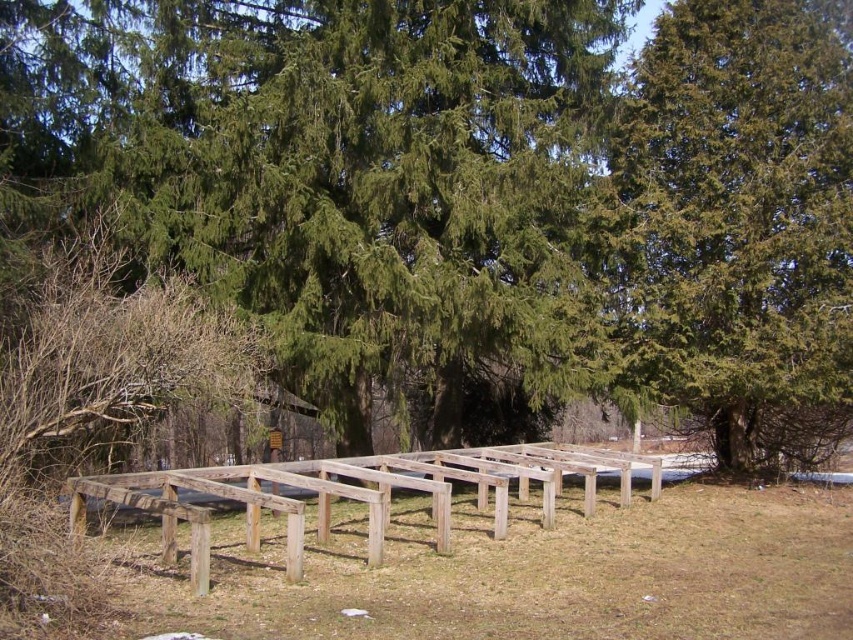
Is green textured tree at upper right behind weathered wood frame at center?

Yes.

Does green textured tree at upper right have a smaller size compared to weathered wood frame at center?

Indeed, green textured tree at upper right has a smaller size compared to weathered wood frame at center.

Is point (659, 339) positioned in front of point (485, 460)?

No, (659, 339) is behind (485, 460).

The width and height of the screenshot is (853, 640). I want to click on green textured tree at upper right, so click(740, 225).